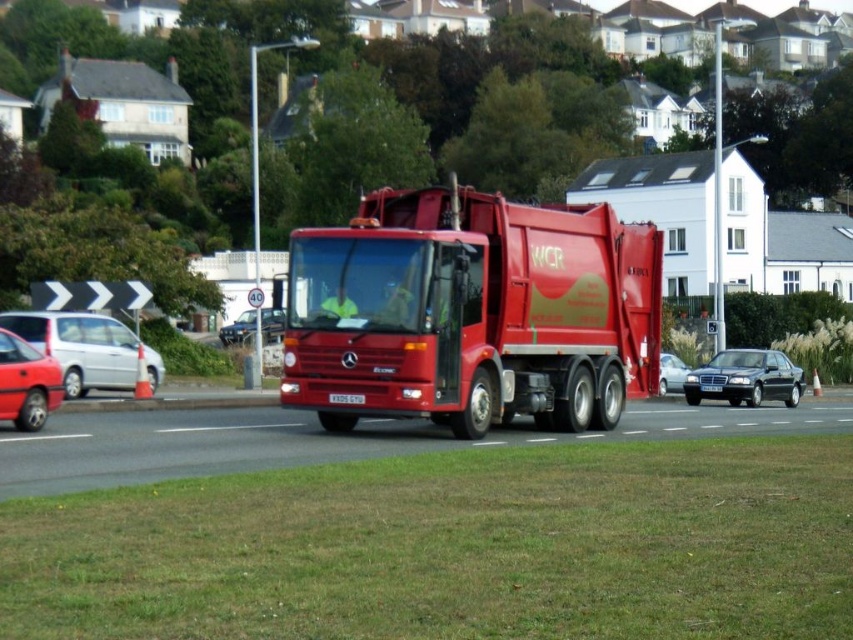
Question: Observing the image, what is the correct spatial positioning of shiny red truck at center in reference to shiny black sedan at center?

Choices:
 (A) below
 (B) above

Answer: (B)

Question: Which is nearer to the shiny silver sedan at center?

Choices:
 (A) shiny black sedan at center
 (B) silver metallic van at left
 (C) whitemetalliclicense plate at center

Answer: (A)

Question: Which of the following is the farthest from the observer?

Choices:
 (A) silver metallic van at left
 (B) black plastic license plate at center
 (C) matte red car at lower left

Answer: (B)

Question: Which of the following is the closest to the observer?

Choices:
 (A) (39, 317)
 (B) (276, 324)

Answer: (A)

Question: Can you confirm if silver metallic van at left is wider than metallic silver car at center?

Choices:
 (A) no
 (B) yes

Answer: (A)

Question: Where is matte red car at lower left located in relation to shiny silver sedan at center in the image?

Choices:
 (A) right
 (B) left

Answer: (B)